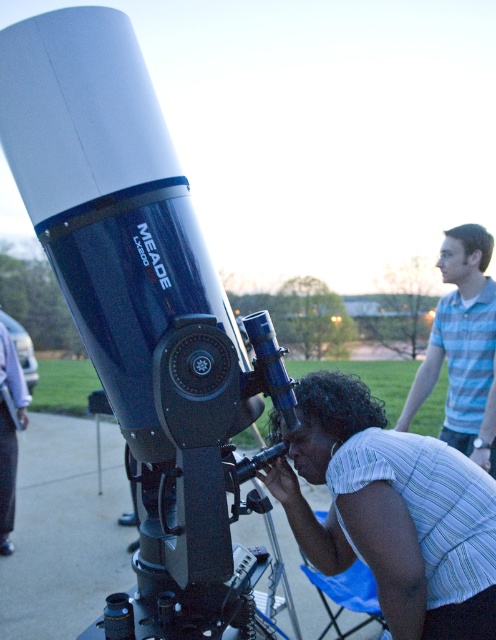
Question: Which object is positioned farthest from the white striped shirt at center?

Choices:
 (A) brushed metal jacket at lower left
 (B) blue striped shirt at upper right
 (C) matte black telescope at center

Answer: (A)

Question: Which object is farther from the camera taking this photo?

Choices:
 (A) white striped shirt at center
 (B) blue striped shirt at upper right

Answer: (B)

Question: Is matte black telescope at center smaller than brushed metal jacket at lower left?

Choices:
 (A) yes
 (B) no

Answer: (B)

Question: Can you confirm if matte black telescope at center is positioned to the left of blue striped shirt at upper right?

Choices:
 (A) no
 (B) yes

Answer: (B)

Question: Which point is farther to the camera?

Choices:
 (A) (430, 612)
 (B) (3, 506)
 (C) (124, 150)
 (D) (475, 401)

Answer: (B)

Question: Is matte black telescope at center thinner than brushed metal jacket at lower left?

Choices:
 (A) no
 (B) yes

Answer: (A)